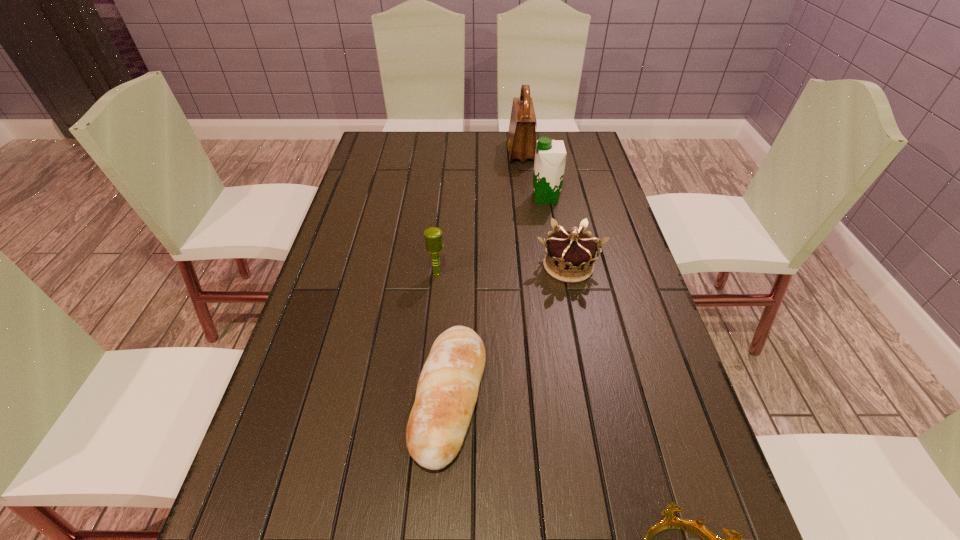
In the image, there is a desktop. At what (x,y) coordinates should I click in order to perform the action: click on vacant region at the left edge. Please return your answer as a coordinate pair (x, y). The width and height of the screenshot is (960, 540). Looking at the image, I should click on (383, 197).

In the image, there is a desktop. At what (x,y) coordinates should I click in order to perform the action: click on free space at the right edge. Please return your answer as a coordinate pair (x, y). This screenshot has width=960, height=540. Looking at the image, I should click on (598, 237).

Find the location of a particular element. The width and height of the screenshot is (960, 540). vacant area between the farther crown and the microphone is located at coordinates (503, 269).

Find the location of a particular element. The height and width of the screenshot is (540, 960). unoccupied position between the microphone and the farther crown is located at coordinates (503, 269).

Locate which object ranks second in proximity to the shoulder bag. Please provide its 2D coordinates. Your answer should be formatted as a tuple, i.e. [(x, y)], where the tuple contains the x and y coordinates of a point satisfying the conditions above.

[(570, 255)]

Choose which object is the nearest neighbor to the second farthest object. Please provide its 2D coordinates. Your answer should be formatted as a tuple, i.e. [(x, y)], where the tuple contains the x and y coordinates of a point satisfying the conditions above.

[(521, 145)]

What are the coordinates of `blank space that satisfies the following two spatial constraints: 1. on the front side of the bread; 2. on the right side of the microphone` in the screenshot? It's located at (425, 397).

Find the location of a particular element. free location that satisfies the following two spatial constraints: 1. on the front flap of the farther crown; 2. on the right side of the tallest object is located at coordinates (535, 266).

You are a GUI agent. You are given a task and a screenshot of the screen. Output one action in this format:
    pyautogui.click(x=<x>, y=<y>)
    Task: Click on the vacant area in the image that satisfies the following two spatial constraints: 1. on the front side of the microphone; 2. on the left side of the second nearest object
    The height and width of the screenshot is (540, 960).
    Given the screenshot: What is the action you would take?
    pyautogui.click(x=425, y=397)

The width and height of the screenshot is (960, 540). Identify the location of vacant space that satisfies the following two spatial constraints: 1. on the front side of the microphone; 2. on the right side of the fifth tallest object. pyautogui.click(x=425, y=397).